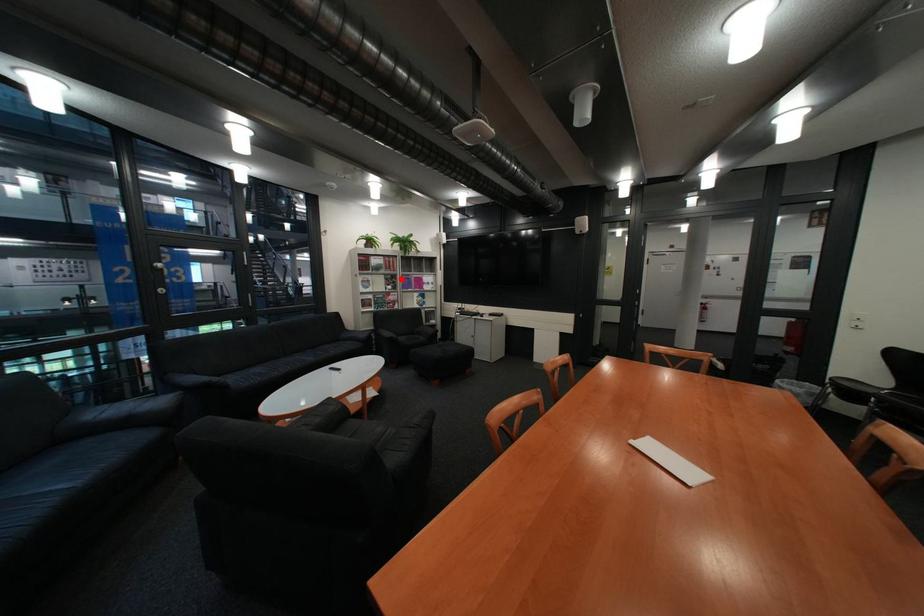
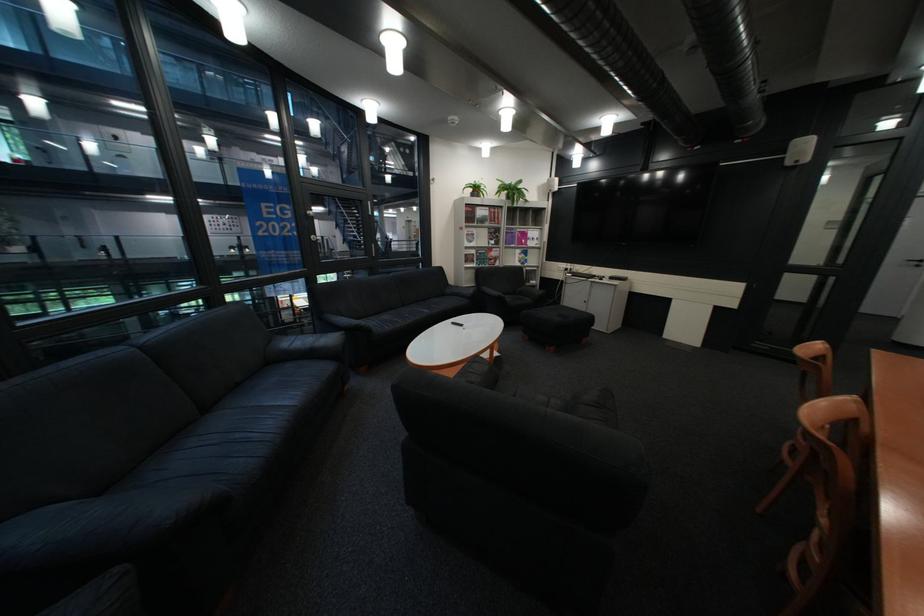
Question: I am providing you with two images of the same scene from different viewpoints. A red point is shown in image1. For the corresponding object point in image2, is it positioned nearer or farther from the camera?

Choices:
 (A) Nearer
 (B) Farther

Answer: (A)